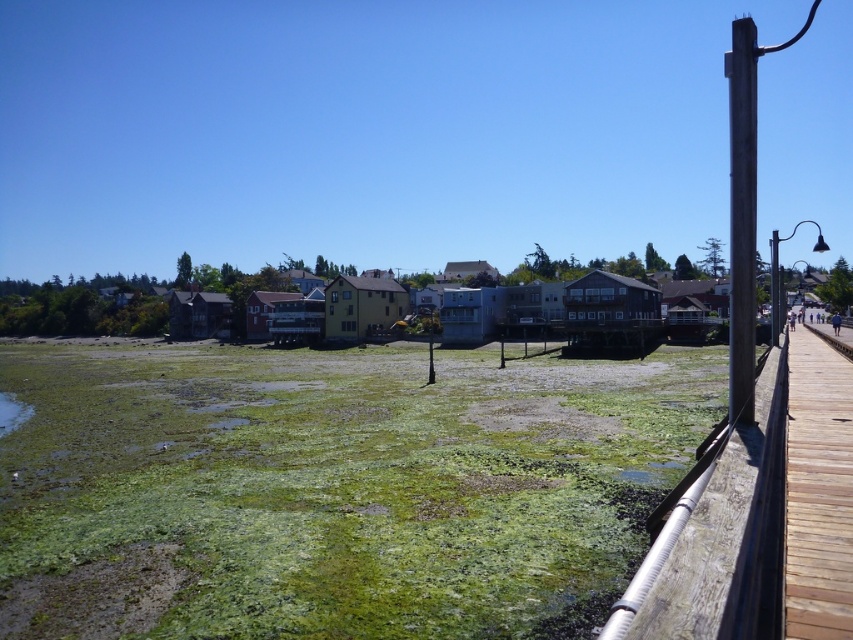
Which of these two, green mossy grass at lower left or wooden dock at right, stands taller?

wooden dock at right

Is green mossy grass at lower left in front of wooden dock at right?

No, it is not.

Where is `green mossy grass at lower left`? This screenshot has width=853, height=640. green mossy grass at lower left is located at coordinates (334, 488).

Which is behind, point (416, 596) or point (846, 422)?

Point (416, 596)

Which of these two, green mossy grass at lower left or wooden at right, stands shorter?

Standing shorter between the two is wooden at right.

Between point (212, 397) and point (811, 545), which one is positioned behind?

The point (212, 397) is more distant.

Locate an element on the screen. The height and width of the screenshot is (640, 853). green mossy grass at lower left is located at coordinates (334, 488).

In the scene shown: How distant is wooden dock at right from brown wooden post at right?

19.32 feet

Is point (781, 403) behind point (732, 196)?

That is True.

Describe the element at coordinates (759, 520) in the screenshot. Image resolution: width=853 pixels, height=640 pixels. I see `wooden dock at right` at that location.

Find the location of a particular element. This screenshot has height=640, width=853. wooden dock at right is located at coordinates (759, 520).